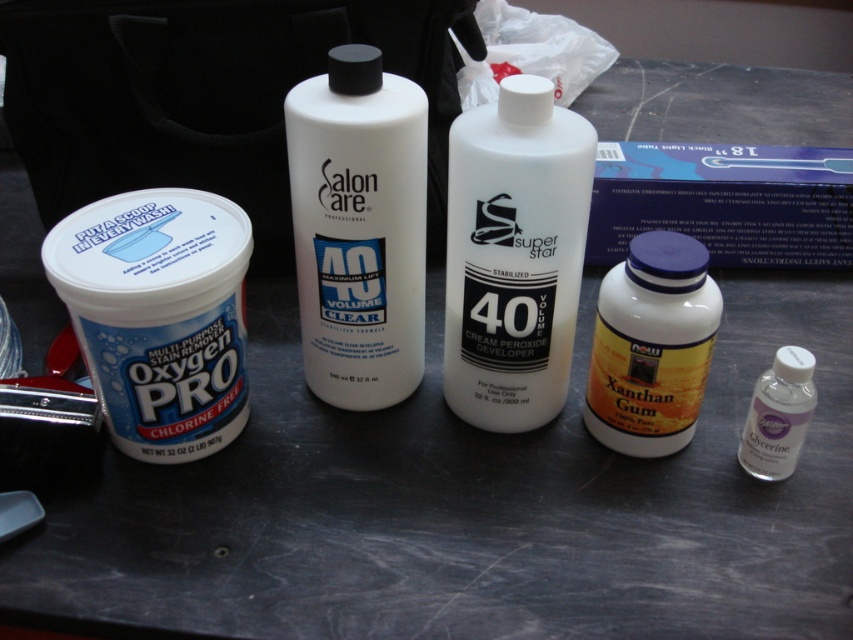
Question: Which of these objects is positioned farthest from the white matte container at left?

Choices:
 (A) clear plastic glycerine at center right
 (B) white plastic bottle at center
 (C) yellow/golden plastic bottle at center-right

Answer: (A)

Question: Is white plastic bottle at center positioned before clear plastic glycerine at center right?

Choices:
 (A) yes
 (B) no

Answer: (A)

Question: Is white matte bottle at center smaller than clear plastic glycerine at center right?

Choices:
 (A) no
 (B) yes

Answer: (A)

Question: Among these points, which one is nearest to the camera?

Choices:
 (A) (759, 460)
 (B) (152, 252)
 (C) (577, 125)

Answer: (C)

Question: Among these points, which one is nearest to the camera?

Choices:
 (A) (213, 392)
 (B) (386, 368)
 (C) (787, 419)

Answer: (C)

Question: Is white plastic bottle at center thinner than white matte container at left?

Choices:
 (A) yes
 (B) no

Answer: (A)